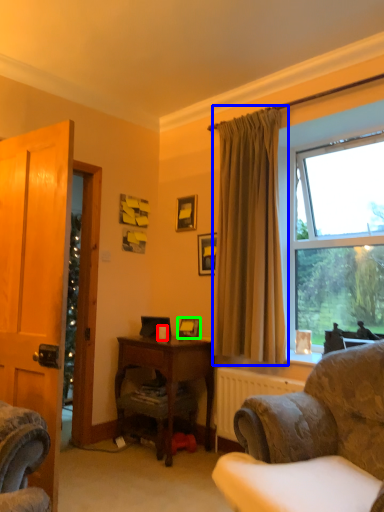
Question: Estimate the real-world distances between objects in this image. Which object is farther from coffee cup (highlighted by a red box), curtain (highlighted by a blue box) or picture frame (highlighted by a green box)?

Choices:
 (A) curtain
 (B) picture frame

Answer: (A)